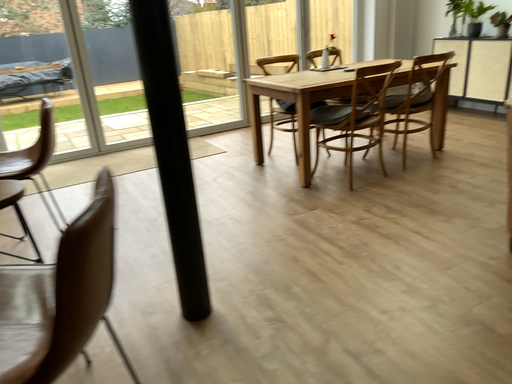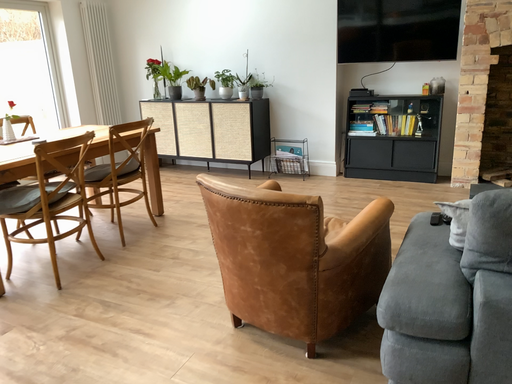
Question: Which way did the camera rotate in the video?

Choices:
 (A) rotated left
 (B) rotated right

Answer: (B)